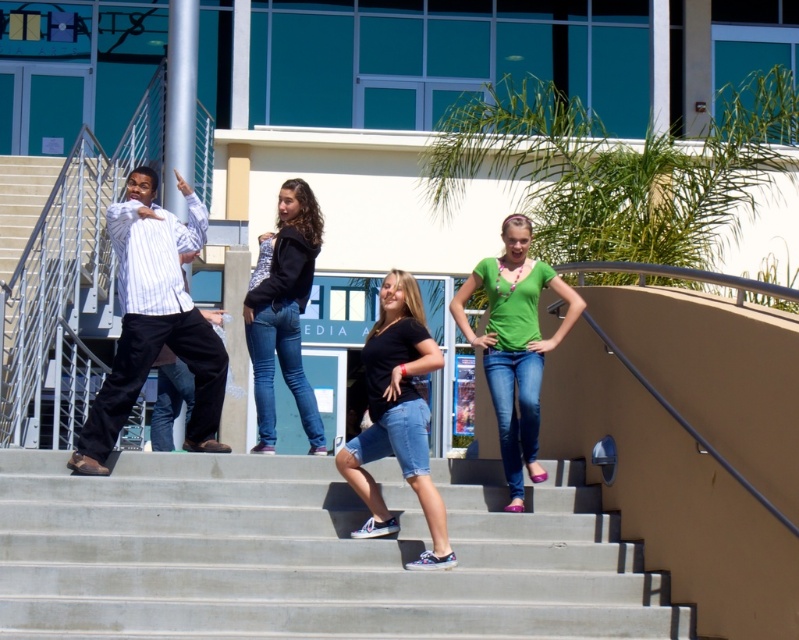
Is black denim shorts at center above matte black hoodie at center?

Actually, black denim shorts at center is below matte black hoodie at center.

The image size is (799, 640). In order to click on black denim shorts at center in this screenshot , I will do `click(396, 417)`.

Who is more forward, [6,577] or [283,365]?

Positioned in front is point [6,577].

Is point (279, 618) farther from camera compared to point (257, 332)?

No, (279, 618) is in front of (257, 332).

Locate an element on the screen. concrete stairs at center is located at coordinates click(x=309, y=554).

Is green matte shirt at center wider than matte black hoodie at center?

Yes, green matte shirt at center is wider than matte black hoodie at center.

Looking at this image, who is positioned more to the left, green matte shirt at center or matte black hoodie at center?

Positioned to the left is matte black hoodie at center.

Which is in front, point (571, 317) or point (253, 300)?

Positioned in front is point (571, 317).

Find the location of `green matte shirt at center`. green matte shirt at center is located at coordinates (515, 344).